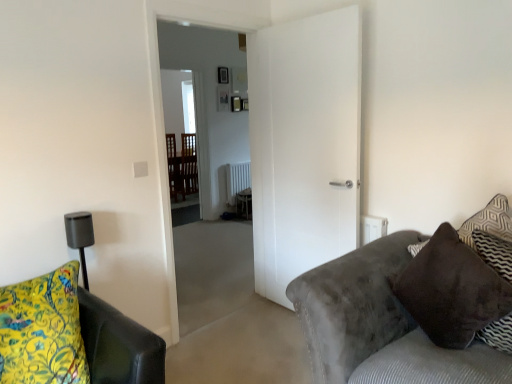
Question: Does point (103, 357) appear closer or farther from the camera than point (188, 79)?

Choices:
 (A) closer
 (B) farther

Answer: (A)

Question: Considering the positions of yellow floral fabric cushion at lower left and transparent glass door at center in the image, is yellow floral fabric cushion at lower left bigger or smaller than transparent glass door at center?

Choices:
 (A) small
 (B) big

Answer: (A)

Question: Estimate the real-world distances between objects in this image. Which object is farther from the white painted radiator at center?

Choices:
 (A) white matte door at center
 (B) yellow floral fabric cushion at lower left
 (C) transparent glass door at center
 (D) brown suede pillow at right
 (E) velvet gray couch at right

Answer: (B)

Question: Based on their relative distances, which object is nearer to the white painted radiator at center?

Choices:
 (A) transparent glass door at center
 (B) velvet gray couch at right
 (C) brown suede pillow at right
 (D) yellow floral fabric cushion at lower left
 (E) white matte door at center

Answer: (A)